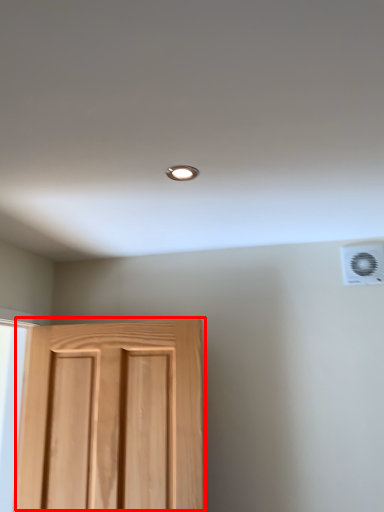
Question: Considering the relative positions of door (annotated by the red box) and air conditioning in the image provided, where is door (annotated by the red box) located with respect to the staircase?

Choices:
 (A) left
 (B) right

Answer: (A)